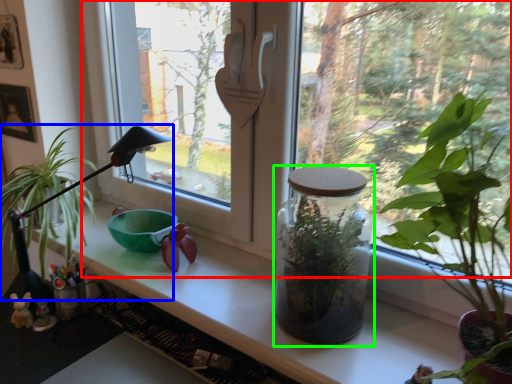
Question: Considering the real-world distances, which object is farthest from window (highlighted by a red box)? houseplant (highlighted by a blue box) or glass jar (highlighted by a green box)?

Choices:
 (A) houseplant
 (B) glass jar

Answer: (A)